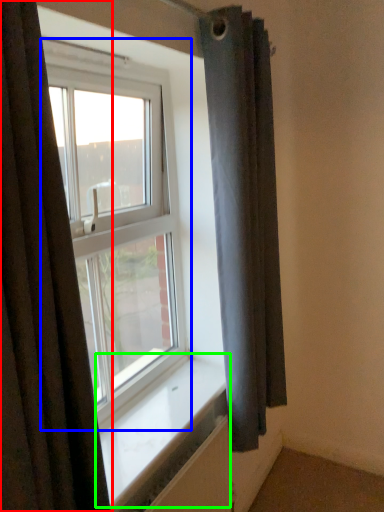
Question: Considering the real-world distances, which object is farthest from curtain (highlighted by a red box)? window (highlighted by a blue box) or window sill (highlighted by a green box)?

Choices:
 (A) window
 (B) window sill

Answer: (A)